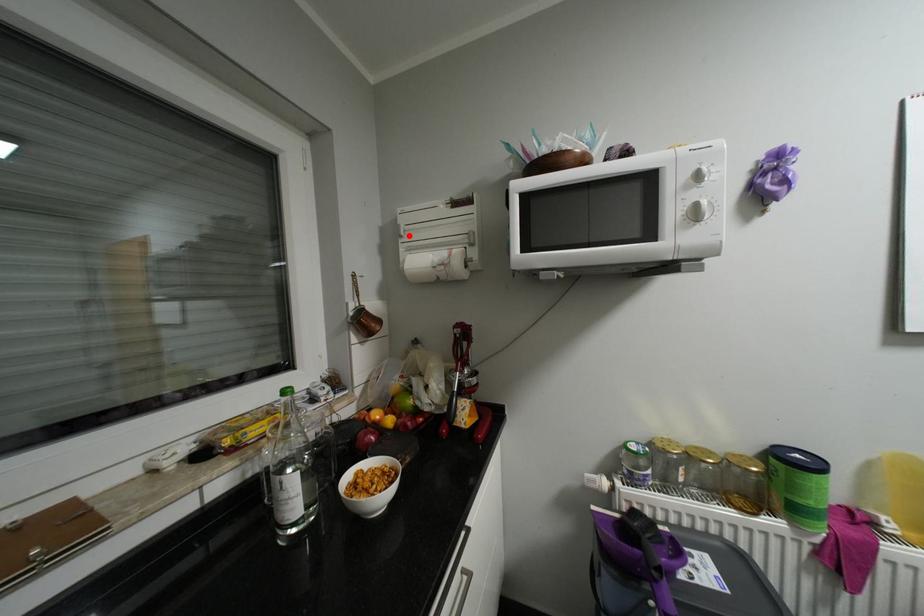
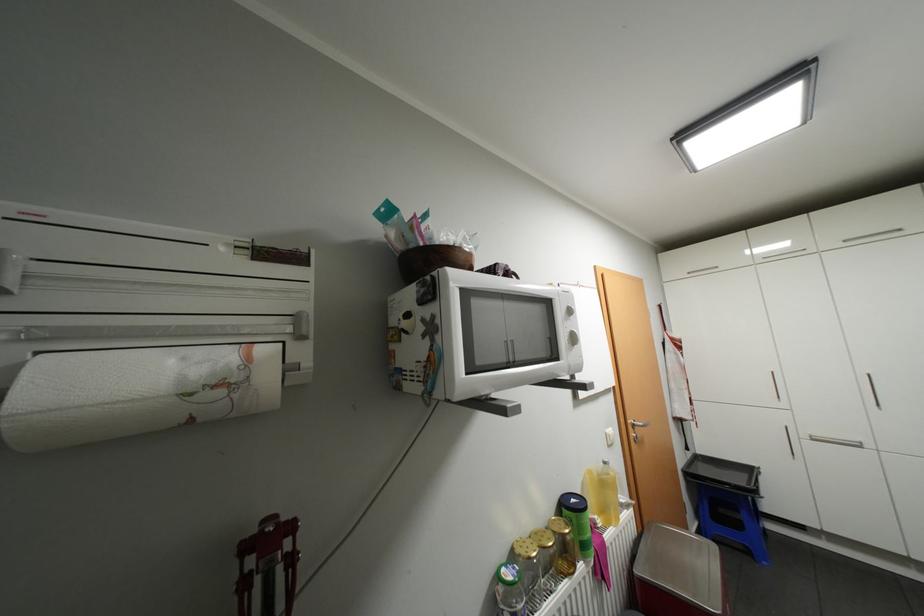
Where in the second image is the point corresponding to the highlighted location from the first image?

(6, 291)